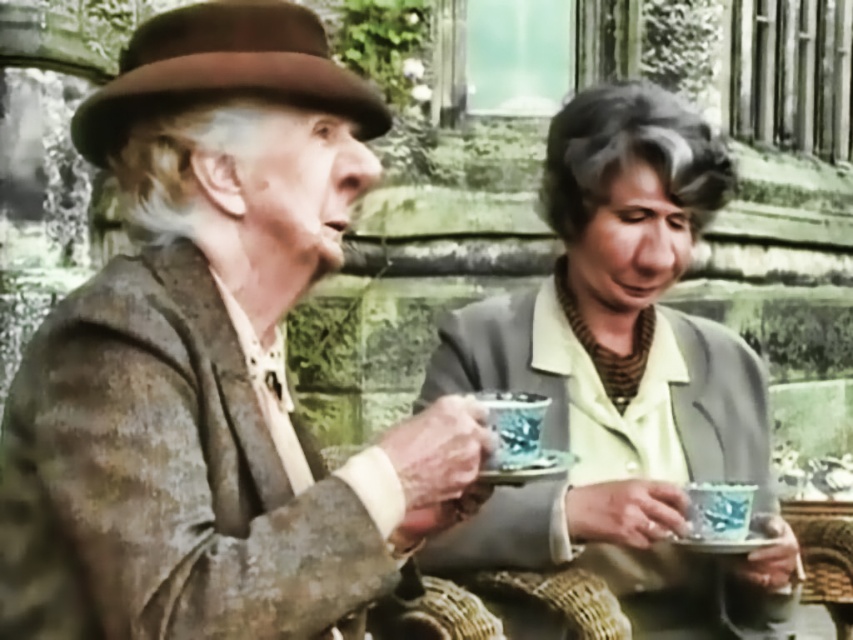
Is distressed brown leather jacket at left positioned in front of matte blue teacup at center?

Yes, it is.

Is distressed brown leather jacket at left shorter than matte blue teacup at center?

Yes.

Between point (53, 440) and point (763, 433), which one is positioned in front?

Point (53, 440) is more forward.

Identify the location of distressed brown leather jacket at left. The image size is (853, 640). (212, 362).

Can you confirm if distressed brown leather jacket at left is positioned below porcelain blue saucer at lower center?

Actually, distressed brown leather jacket at left is above porcelain blue saucer at lower center.

From the picture: Does distressed brown leather jacket at left lie behind porcelain blue saucer at lower center?

That is False.

Is point (283, 406) farther from viewer compared to point (750, 538)?

No.

Find the location of a particular element. The height and width of the screenshot is (640, 853). distressed brown leather jacket at left is located at coordinates (212, 362).

Which is above, matte blue teacup at center or porcelain blue saucer at lower center?

matte blue teacup at center is higher up.

Is matte blue teacup at center shorter than porcelain blue saucer at lower center?

No.

From the picture: Who is more forward, (634, 106) or (685, 544)?

Point (685, 544) is more forward.

Where is `matte blue teacup at center`? Image resolution: width=853 pixels, height=640 pixels. matte blue teacup at center is located at coordinates (622, 371).